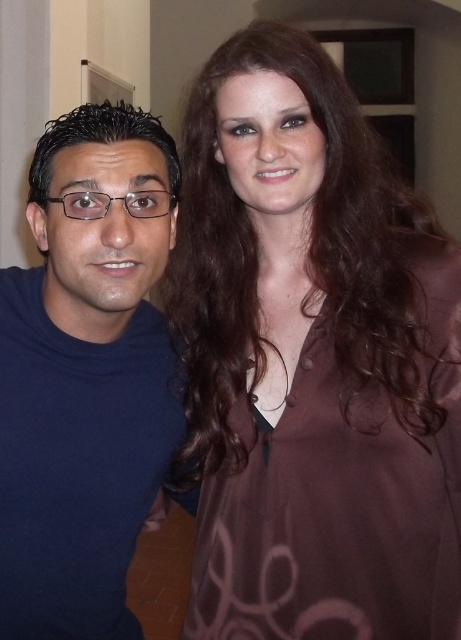
From the picture: You are a photographer setting up a portrait shoot. You have a backdrop that is 1.2 meters wide. The two subjects are wearing the brown satin blouse at upper right and the matte blue shirt at left. Based on their clothing, will the combined width of the two garments fit within the backdrop?

The brown satin blouse at upper right might be wider than matte blue shirt at left, so the combined width of both garments could exceed the 1.2 meter backdrop. It is uncertain if they will fit without overlapping or adjusting their positions.

You are a photographer setting up a shoot in the room described. You need to ensure that the brown satin blouse at upper right and the matte blue shirt at left are both visible in the frame. Given their sizes, which object might require more space in the composition?

The brown satin blouse at upper right requires more space in the composition because it is bigger than the matte blue shirt at left.

You are a photographer setting up for a portrait. You need to position a spotlight to the left of the matte blue shirt at left and to the right of the brown satin blouse at upper right. Is this possible based on their positions?

The brown satin blouse at upper right is to the right of the matte blue shirt at left, so placing a spotlight to the left of the matte blue shirt at left and to the right of the brown satin blouse at upper right is not possible since the required positions overlap.